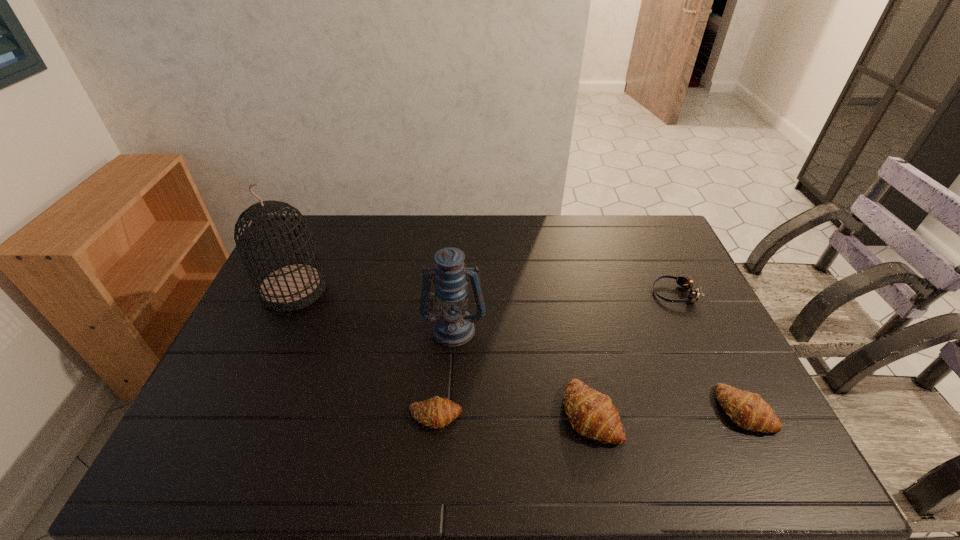
Identify the location of the leftmost crescent roll. click(x=437, y=412).

This screenshot has height=540, width=960. Find the location of `the second crescent roll from right to left`. the second crescent roll from right to left is located at coordinates (591, 413).

What are the coordinates of `the fourth object from left to right` in the screenshot? It's located at (591, 413).

Identify the location of the fourth tallest object. This screenshot has height=540, width=960. (748, 410).

Where is `the second shortest crescent roll`? The height and width of the screenshot is (540, 960). the second shortest crescent roll is located at coordinates (748, 410).

This screenshot has height=540, width=960. Identify the location of the tallest object. (292, 286).

Identify the location of the leftmost object. (292, 286).

The image size is (960, 540). I want to click on the second tallest object, so click(453, 326).

Locate an element on the screen. Image resolution: width=960 pixels, height=540 pixels. goggles is located at coordinates (686, 283).

The height and width of the screenshot is (540, 960). Find the location of `free space located on the back of the shortest crescent roll`. free space located on the back of the shortest crescent roll is located at coordinates (440, 356).